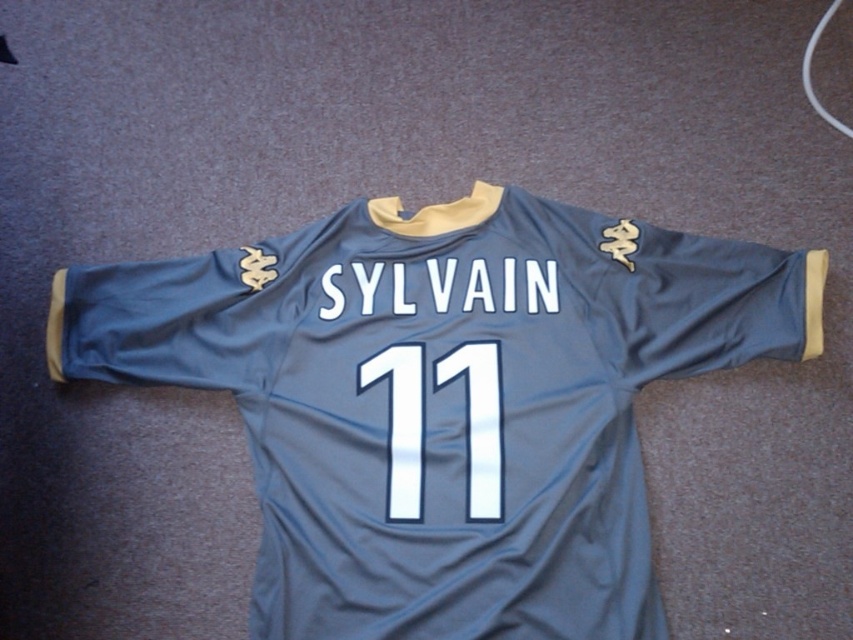
Question: Is matte gray jersey at center smaller than white glossy number at center?

Choices:
 (A) yes
 (B) no

Answer: (B)

Question: Which of the following is the closest to the observer?

Choices:
 (A) white glossy number at center
 (B) matte gray jersey at center

Answer: (B)

Question: Is the position of matte gray jersey at center less distant than that of white glossy number at center?

Choices:
 (A) no
 (B) yes

Answer: (B)

Question: Which object is farther from the camera taking this photo?

Choices:
 (A) white glossy number at center
 (B) matte gray jersey at center

Answer: (A)

Question: Among these points, which one is farthest from the camera?

Choices:
 (A) (410, 465)
 (B) (160, 328)

Answer: (B)

Question: Is matte gray jersey at center behind white glossy number at center?

Choices:
 (A) no
 (B) yes

Answer: (A)